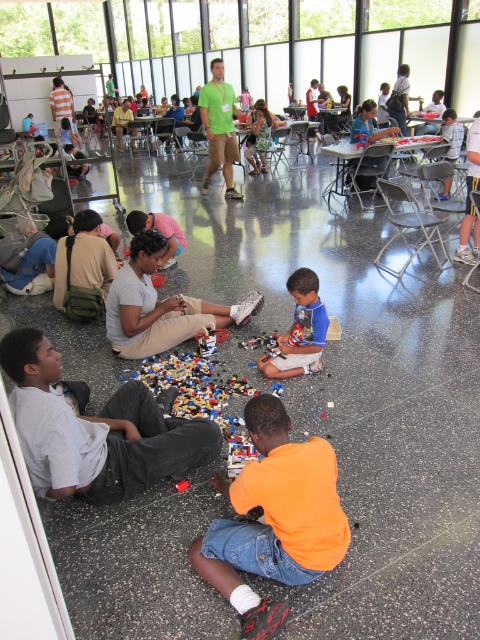
You are a photographer setting up a shoot in this room. You need to place a large tripod between the gray cotton pants at lower left and the blue matte shirt at center. Considering their sizes, which object should the tripod be closer to?

The gray cotton pants at lower left is larger in size than the blue matte shirt at center, so the tripod should be placed closer to the gray cotton pants at lower left to accommodate its larger size.

You are a photographer standing in the room. You want to take a photo that includes both the gray cotton pants at lower left and the blue matte shirt at center. Which object should be placed closer to the camera to ensure both are in focus?

The gray cotton pants at lower left is much taller than the blue matte shirt at center. To ensure both are in focus, the gray cotton pants at lower left should be placed closer to the camera since it is taller and requires more depth of field.

You are a photographer standing in the room and want to take a photo of the gray cotton pants at lower left and orange matte shirt at lower center. The camera you are using has a maximum focus range of 24 inches. Can you capture both subjects in focus without moving the camera or the subjects?

The gray cotton pants at lower left is 24.09 inches from the orange matte shirt at lower center. Since the distance between them is slightly more than 24 inches, the camera cannot focus on both subjects simultaneously without adjusting the focus range or moving them closer.